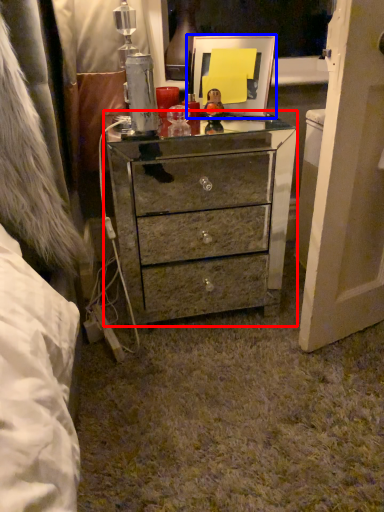
Question: Which object appears farthest to the camera in this image, chest of drawers (highlighted by a red box) or picture frame (highlighted by a blue box)?

Choices:
 (A) chest of drawers
 (B) picture frame

Answer: (B)